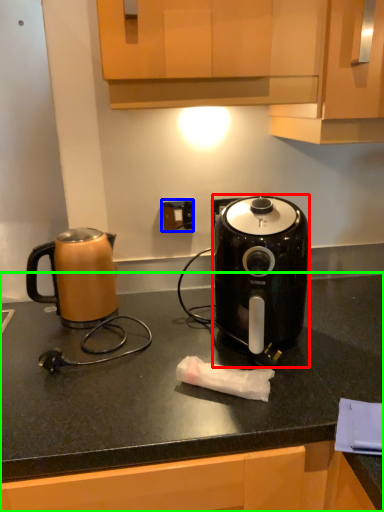
Question: Based on their relative distances, which object is nearer to toaster (highlighted by a red box)? Choose from electric outlet (highlighted by a blue box) and countertop (highlighted by a green box).

Choices:
 (A) electric outlet
 (B) countertop

Answer: (B)